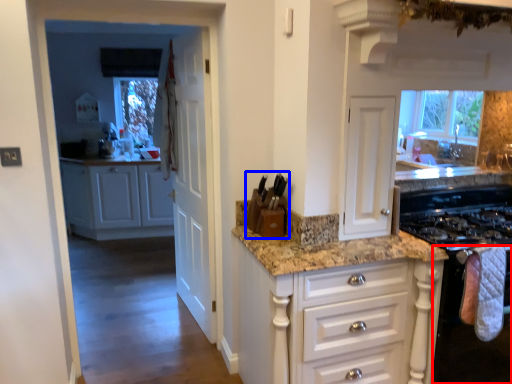
Question: Among these objects, which one is nearest to the camera, oven (highlighted by a red box) or appliance (highlighted by a blue box)?

Choices:
 (A) oven
 (B) appliance

Answer: (A)